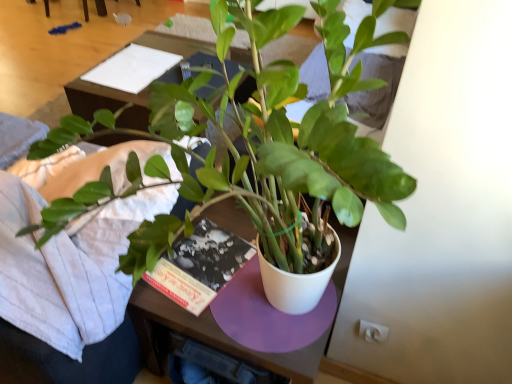
Locate an element on the screen. wooden table at center is located at coordinates (108, 102).

Where is `green matte plant at center`? The height and width of the screenshot is (384, 512). green matte plant at center is located at coordinates (304, 133).

Find the location of a particular element. The image size is (512, 384). white paper at upper center is located at coordinates (132, 68).

Does green matte plant at center appear on the right side of white paper at upper center?

Correct, you'll find green matte plant at center to the right of white paper at upper center.

Which of these two, green matte plant at center or white paper at upper center, is thinner?

white paper at upper center.

Which is farther, (273,264) or (169,64)?

Point (169,64)

How distant is wooden table at center from white paper at upper center?

wooden table at center is 23.16 inches away from white paper at upper center.

Which of these two, wooden table at center or white paper at upper center, is wider?

wooden table at center is wider.

Considering the sizes of objects wooden table at center and white paper at upper center in the image provided, who is smaller, wooden table at center or white paper at upper center?

With smaller size is white paper at upper center.

Between wooden table at center and white paper at upper center, which one appears on the right side from the viewer's perspective?

From the viewer's perspective, wooden table at center appears more on the right side.

From a real-world perspective, which object rests below the other?

From a 3D spatial view, wooden table at center is below.

Measure the distance from wooden table at center to green matte plant at center.

wooden table at center and green matte plant at center are 6.73 feet apart from each other.

Does wooden table at center touch green matte plant at center?

wooden table at center and green matte plant at center are not in contact.

Relative to green matte plant at center, is wooden table at center in front or behind?

wooden table at center is behind green matte plant at center.

Where is `book behind the green matte plant at center`? book behind the green matte plant at center is located at coordinates (132, 68).

Is white paper at upper center looking in the opposite direction of green matte plant at center?

That's not correct — white paper at upper center is not looking away from green matte plant at center.

Is white paper at upper center further to the viewer compared to green matte plant at center?

Yes, white paper at upper center is behind green matte plant at center.

Would you say white paper at upper center is to the left or to the right of green matte plant at center in the picture?

From the image, it's evident that white paper at upper center is to the left of green matte plant at center.

Which of these two, white paper at upper center or wooden table at center, is wider?

wooden table at center.

From the image's perspective, would you say white paper at upper center is positioned over wooden table at center?

Yes, from the image's perspective, white paper at upper center is above wooden table at center.

Considering the positions of objects white paper at upper center and wooden table at center in the image provided, who is more to the left, white paper at upper center or wooden table at center?

white paper at upper center.

Does white paper at upper center have a lesser height compared to wooden table at center?

Correct, white paper at upper center is not as tall as wooden table at center.

Which of these two, green matte plant at center or wooden table at center, is thinner?

wooden table at center.

What's the angular difference between green matte plant at center and wooden table at center's facing directions?

The angular difference between green matte plant at center and wooden table at center is 0.000171 degrees.

Is the surface of green matte plant at center in direct contact with wooden table at center?

No, green matte plant at center is not next to wooden table at center.

Considering the positions of point (339, 51) and point (92, 115), is point (339, 51) closer or farther from the camera than point (92, 115)?

Clearly, point (339, 51) is closer to the camera than point (92, 115).

Identify the location of houseplant in front of the white paper at upper center. The image size is (512, 384). (304, 133).

In the image, there is a wooden table at center. At what (x,y) coordinates should I click in order to perform the action: click on book above it (from the image's perspective). Please return your answer as a coordinate pair (x, y). This screenshot has width=512, height=384. Looking at the image, I should click on click(x=132, y=68).

Which object lies further to the anchor point green matte plant at center, wooden table at center or white paper at upper center?

wooden table at center.

Based on their spatial positions, is white paper at upper center or green matte plant at center further from wooden table at center?

Based on the image, green matte plant at center appears to be further to wooden table at center.

Based on their spatial positions, is green matte plant at center or wooden table at center closer to white paper at upper center?

The object closer to white paper at upper center is wooden table at center.

Estimate the real-world distances between objects in this image. Which object is further from green matte plant at center, white paper at upper center or wooden table at center?

The object further to green matte plant at center is wooden table at center.

From the image, which object appears to be nearer to wooden table at center, green matte plant at center or white paper at upper center?

Among the two, white paper at upper center is located nearer to wooden table at center.

Looking at the image, which one is located closer to white paper at upper center, wooden table at center or green matte plant at center?

wooden table at center.

Locate an element on the screen. The width and height of the screenshot is (512, 384). table between green matte plant at center and white paper at upper center in the front-back direction is located at coordinates (108, 102).